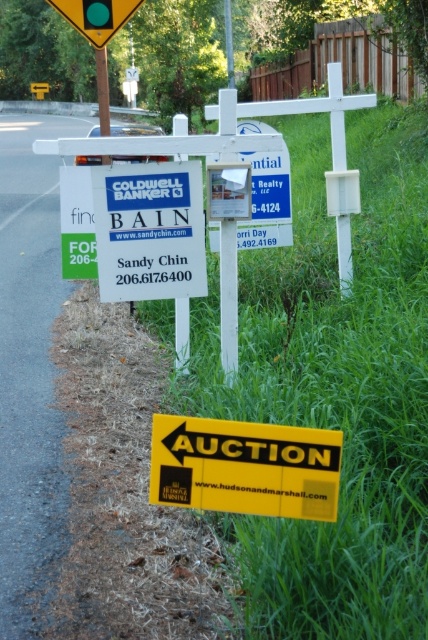
Which of these two, yellow matte auction sign at lower center or metallic yellow triangle at upper center, stands shorter?

yellow matte auction sign at lower center

Locate an element on the screen. The width and height of the screenshot is (428, 640). yellow matte auction sign at lower center is located at coordinates (244, 467).

Which of these two, green grass at lower right or yellow matte auction sign at lower center, stands shorter?

Standing shorter between the two is yellow matte auction sign at lower center.

Is point (374, 180) in front of point (309, 497)?

No, it is not.

Which is in front, point (294, 172) or point (217, 449)?

Positioned in front is point (217, 449).

Image resolution: width=428 pixels, height=640 pixels. What are the coordinates of `green grass at lower right` in the screenshot? It's located at click(335, 385).

Can you confirm if green grass at lower right is smaller than metallic yellow triangle at upper center?

Incorrect, green grass at lower right is not smaller in size than metallic yellow triangle at upper center.

Which is in front, point (353, 154) or point (77, 3)?

Point (77, 3)

What do you see at coordinates (335, 385) in the screenshot? I see `green grass at lower right` at bounding box center [335, 385].

Where is `green grass at lower right`? Image resolution: width=428 pixels, height=640 pixels. green grass at lower right is located at coordinates (335, 385).